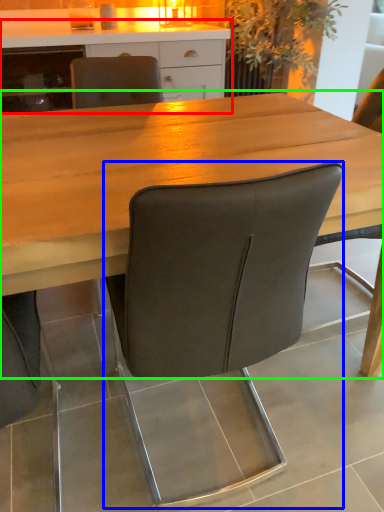
Question: Based on their relative distances, which object is nearer to cabinetry (highlighted by a red box)? Choose from chair (highlighted by a blue box) and table (highlighted by a green box).

Choices:
 (A) chair
 (B) table

Answer: (B)